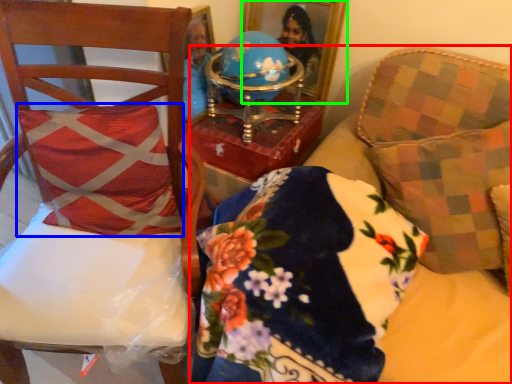
Question: Which is nearer to the furniture (highlighted by a red box)? throw pillow (highlighted by a blue box) or picture frame (highlighted by a green box).

Choices:
 (A) throw pillow
 (B) picture frame

Answer: (A)